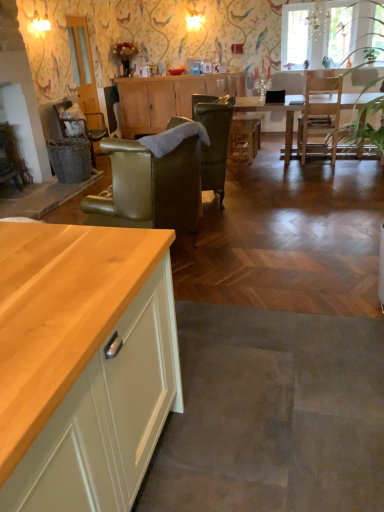
Question: From a real-world perspective, does wooden counter at lower left sit lower than wooden cabinet at center?

Choices:
 (A) yes
 (B) no

Answer: (A)

Question: Is wooden counter at lower left outside of wooden cabinet at center?

Choices:
 (A) no
 (B) yes

Answer: (B)

Question: Considering the relative positions of wooden counter at lower left and wooden cabinet at center in the image provided, is wooden counter at lower left to the left of wooden cabinet at center from the viewer's perspective?

Choices:
 (A) no
 (B) yes

Answer: (B)

Question: Considering the relative positions of wooden counter at lower left and wooden cabinet at center in the image provided, is wooden counter at lower left in front of wooden cabinet at center?

Choices:
 (A) no
 (B) yes

Answer: (B)

Question: Is the surface of wooden counter at lower left in direct contact with wooden cabinet at center?

Choices:
 (A) yes
 (B) no

Answer: (B)

Question: Does wooden counter at lower left appear on the right side of wooden cabinet at center?

Choices:
 (A) yes
 (B) no

Answer: (B)

Question: Can you see clear glass door at upper left touching leather-like green armchair at center-left, which ranks as the first chair in front-to-back order?

Choices:
 (A) no
 (B) yes

Answer: (A)

Question: Is there a large distance between clear glass door at upper left and leather-like green armchair at center-left, positioned as the second chair in left-to-right order?

Choices:
 (A) no
 (B) yes

Answer: (B)

Question: Considering the relative sizes of clear glass door at upper left and leather-like green armchair at center-left, the 2th chair when ordered from right to left, in the image provided, is clear glass door at upper left thinner than leather-like green armchair at center-left, the 2th chair when ordered from right to left,?

Choices:
 (A) no
 (B) yes

Answer: (B)

Question: Considering the relative positions of clear glass door at upper left and leather-like green armchair at center-left, which ranks as the first chair in front-to-back order, in the image provided, is clear glass door at upper left to the right of leather-like green armchair at center-left, which ranks as the first chair in front-to-back order, from the viewer's perspective?

Choices:
 (A) yes
 (B) no

Answer: (B)

Question: Does clear glass door at upper left have a greater height compared to leather-like green armchair at center-left, which ranks as the first chair in front-to-back order?

Choices:
 (A) no
 (B) yes

Answer: (B)

Question: Does clear glass door at upper left turn towards leather-like green armchair at center-left, positioned as the second chair in left-to-right order?

Choices:
 (A) yes
 (B) no

Answer: (B)

Question: Does transparent glass window at upper center have a larger size compared to wooden cabinet at center?

Choices:
 (A) no
 (B) yes

Answer: (A)